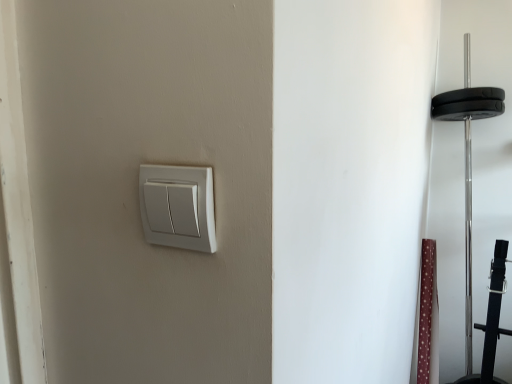
This screenshot has height=384, width=512. I want to click on maroon fabric curtain at right, so click(x=428, y=316).

This screenshot has height=384, width=512. What do you see at coordinates (428, 316) in the screenshot?
I see `maroon fabric curtain at right` at bounding box center [428, 316].

At what (x,y) coordinates should I click in order to perform the action: click on maroon fabric curtain at right. Please return your answer as a coordinate pair (x, y). Looking at the image, I should click on (428, 316).